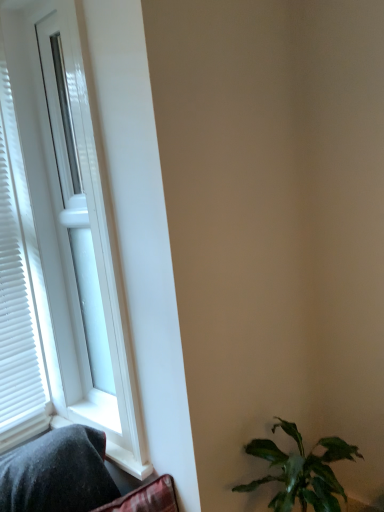
This screenshot has width=384, height=512. In order to click on green leafy plant at lower right in this screenshot , I will do `click(302, 471)`.

Describe the element at coordinates (302, 471) in the screenshot. I see `green leafy plant at lower right` at that location.

Describe the element at coordinates (62, 246) in the screenshot. This screenshot has height=512, width=384. I see `white glossy window at left` at that location.

Identify the location of white glossy window at left. This screenshot has width=384, height=512. (62, 246).

In order to face white glossy window at left, should I rotate leftwards or rightwards?

Rotate your view left by about 15.670°.

You are a GUI agent. You are given a task and a screenshot of the screen. Output one action in this format:
    pyautogui.click(x=<x>, y=<y>)
    Task: Click on the green leafy plant at lower right
    
    Given the screenshot: What is the action you would take?
    pyautogui.click(x=302, y=471)

Would you say green leafy plant at lower right is to the left or to the right of white glossy window at left in the picture?

From the image, it's evident that green leafy plant at lower right is to the right of white glossy window at left.

Is green leafy plant at lower right further to camera compared to white glossy window at left?

No, green leafy plant at lower right is closer to the camera.

Considering the positions of point (305, 497) and point (36, 221), is point (305, 497) closer or farther from the camera than point (36, 221)?

Clearly, point (305, 497) is closer to the camera than point (36, 221).

From the image's perspective, which one is positioned higher, green leafy plant at lower right or white glossy window at left?

white glossy window at left, from the image's perspective.

From a real-world perspective, which is physically below, green leafy plant at lower right or white glossy window at left?

green leafy plant at lower right, from a real-world perspective.

Is green leafy plant at lower right thinner than white glossy window at left?

No.

Can you confirm if green leafy plant at lower right is shorter than white glossy window at left?

Yes.

Considering the sizes of objects green leafy plant at lower right and white glossy window at left in the image provided, who is smaller, green leafy plant at lower right or white glossy window at left?

green leafy plant at lower right.

Can we say green leafy plant at lower right lies outside white glossy window at left?

That's correct, green leafy plant at lower right is outside of white glossy window at left.

Is green leafy plant at lower right directly adjacent to white glossy window at left?

They are not placed beside each other.

Does green leafy plant at lower right turn towards white glossy window at left?

No, green leafy plant at lower right is not facing towards white glossy window at left.

Can you tell me how much green leafy plant at lower right and white glossy window at left differ in facing direction?

The angle between the facing direction of green leafy plant at lower right and the facing direction of white glossy window at left is 1.38 degrees.

Where is `houseplant that appears below the white glossy window at left (from a real-world perspective)`? The width and height of the screenshot is (384, 512). houseplant that appears below the white glossy window at left (from a real-world perspective) is located at coordinates (302, 471).

Based on their positions, is white glossy window at left located to the left or right of green leafy plant at lower right?

From the image, it's evident that white glossy window at left is to the left of green leafy plant at lower right.

From the picture: Considering their positions, is white glossy window at left located in front of or behind green leafy plant at lower right?

Clearly, white glossy window at left is behind green leafy plant at lower right.

Is point (30, 130) more distant than point (277, 447)?

Yes, point (30, 130) is behind point (277, 447).

In the scene shown: From the image's perspective, is white glossy window at left located above green leafy plant at lower right?

Yes.

From the picture: From a real-world perspective, is white glossy window at left on top of green leafy plant at lower right?

Yes, from a real-world perspective, white glossy window at left is on top of green leafy plant at lower right.

Can you confirm if white glossy window at left is thinner than green leafy plant at lower right?

Correct, the width of white glossy window at left is less than that of green leafy plant at lower right.

Who is shorter, white glossy window at left or green leafy plant at lower right?

Standing shorter between the two is green leafy plant at lower right.

Is white glossy window at left smaller than green leafy plant at lower right?

Actually, white glossy window at left might be larger than green leafy plant at lower right.

Would you say white glossy window at left is inside or outside green leafy plant at lower right?

The correct answer is: outside.

Can you see white glossy window at left touching green leafy plant at lower right?

white glossy window at left and green leafy plant at lower right are clearly separated.

Could you tell me if white glossy window at left is turned towards green leafy plant at lower right?

No, white glossy window at left is not turned towards green leafy plant at lower right.

Can you tell me how much white glossy window at left and green leafy plant at lower right differ in facing direction?

The facing directions of white glossy window at left and green leafy plant at lower right are 1.38 degrees apart.

Measure the distance from white glossy window at left to green leafy plant at lower right.

28.28 inches.

Locate an element on the screen. The height and width of the screenshot is (512, 384). window above the green leafy plant at lower right (from the image's perspective) is located at coordinates (62, 246).

The image size is (384, 512). I want to click on window located above the green leafy plant at lower right (from a real-world perspective), so click(62, 246).

Where is `window on the left of green leafy plant at lower right`? window on the left of green leafy plant at lower right is located at coordinates (62, 246).